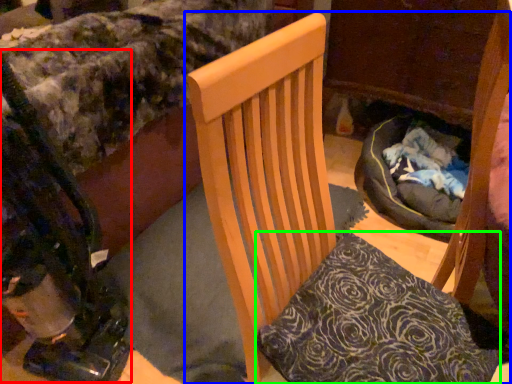
Question: Which is nearer to the baby carriage (highlighted by a red box)? chair (highlighted by a blue box) or pillow (highlighted by a green box).

Choices:
 (A) chair
 (B) pillow

Answer: (A)